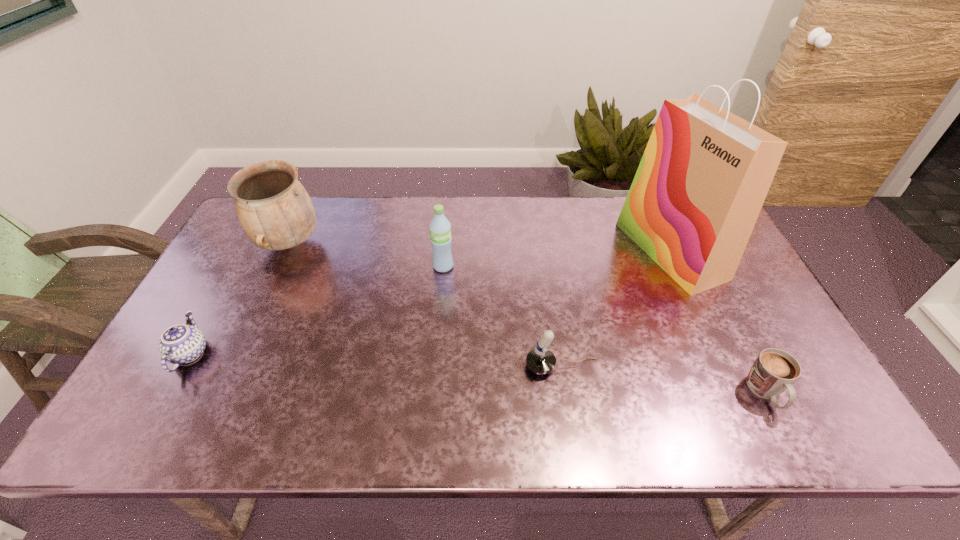
You are a GUI agent. You are given a task and a screenshot of the screen. Output one action in this format:
    pyautogui.click(x=<x>, y=<y>)
    Task: Click on the vacant space that's between the shopping bag and the third object from left to right
    The image size is (960, 540).
    Given the screenshot: What is the action you would take?
    pyautogui.click(x=557, y=259)

Find the location of a particular element. This screenshot has height=540, width=960. free space between the urn and the mug is located at coordinates (528, 319).

In order to click on free space between the urn and the shopping bag in this screenshot , I will do `click(480, 247)`.

You are a GUI agent. You are given a task and a screenshot of the screen. Output one action in this format:
    pyautogui.click(x=<x>, y=<y>)
    Task: Click on the free space that is in between the fourth object from right to left and the mug
    The width and height of the screenshot is (960, 540).
    Given the screenshot: What is the action you would take?
    pyautogui.click(x=605, y=330)

Identify the location of vacant point located between the mug and the water bottle. (605, 330).

Find the location of a particular element. unoccupied position between the tallest object and the mug is located at coordinates (718, 322).

At what (x,y) coordinates should I click in order to perform the action: click on free space that is in between the chinaware and the third object from right to left. Please return your answer as a coordinate pair (x, y). The image size is (960, 540). Looking at the image, I should click on (375, 360).

Choose which object is the nearest neighbor to the shopping bag. Please provide its 2D coordinates. Your answer should be formatted as a tuple, i.e. [(x, y)], where the tuple contains the x and y coordinates of a point satisfying the conditions above.

[(774, 371)]

Locate which object is the fifth closest to the urn. Please provide its 2D coordinates. Your answer should be formatted as a tuple, i.e. [(x, y)], where the tuple contains the x and y coordinates of a point satisfying the conditions above.

[(774, 371)]

At what (x,y) coordinates should I click in order to perform the action: click on vacant space that satisfies the following two spatial constraints: 1. at the spout of the chinaware; 2. on the left side of the microphone. Please return your answer as a coordinate pair (x, y). This screenshot has height=540, width=960. Looking at the image, I should click on (182, 366).